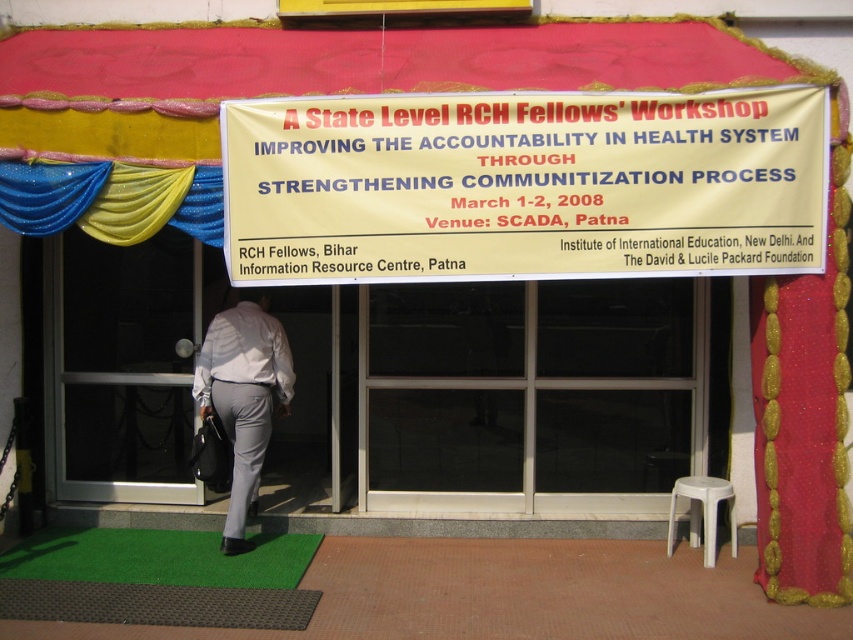
Is point (252, 600) closer to viewer compared to point (24, 218)?

Yes.

You are a GUI agent. You are given a task and a screenshot of the screen. Output one action in this format:
    pyautogui.click(x=<x>, y=<y>)
    Task: Click on the brown textured mat at lower center
    
    Given the screenshot: What is the action you would take?
    pyautogui.click(x=155, y=604)

Can you confirm if green artificial turf mat at lower center is shorter than light gray trousers at center?

Yes.

Between green artificial turf mat at lower center and light gray trousers at center, which one is positioned lower?

green artificial turf mat at lower center

I want to click on green artificial turf mat at lower center, so click(160, 557).

Image resolution: width=853 pixels, height=640 pixels. Find the location of `green artificial turf mat at lower center`. green artificial turf mat at lower center is located at coordinates (160, 557).

Does transparent glass door at left have a greater height compared to red fabric curtain at right?

Incorrect, transparent glass door at left's height is not larger of red fabric curtain at right's.

Does transparent glass door at left have a lesser width compared to red fabric curtain at right?

Incorrect, transparent glass door at left's width is not less than red fabric curtain at right's.

I want to click on transparent glass door at left, so click(x=126, y=365).